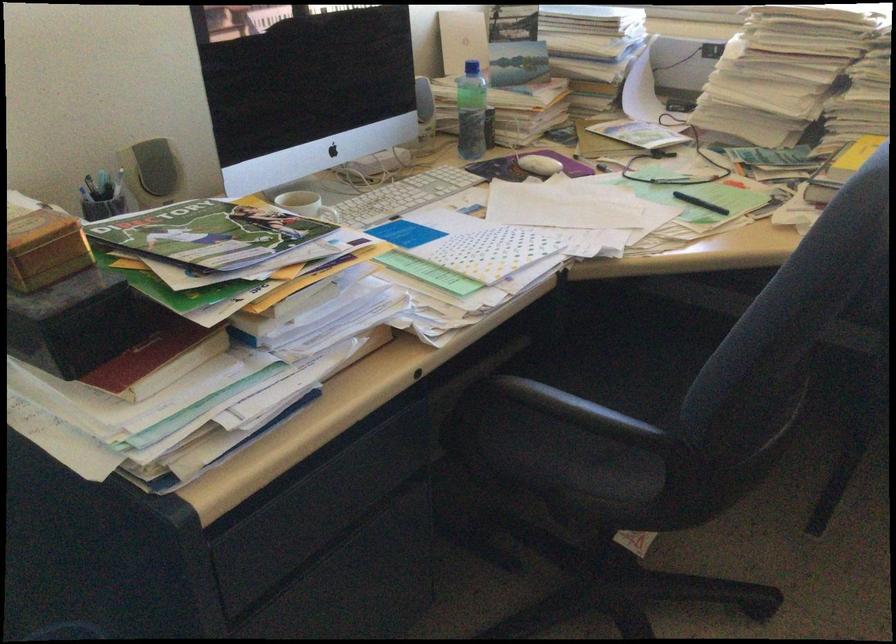
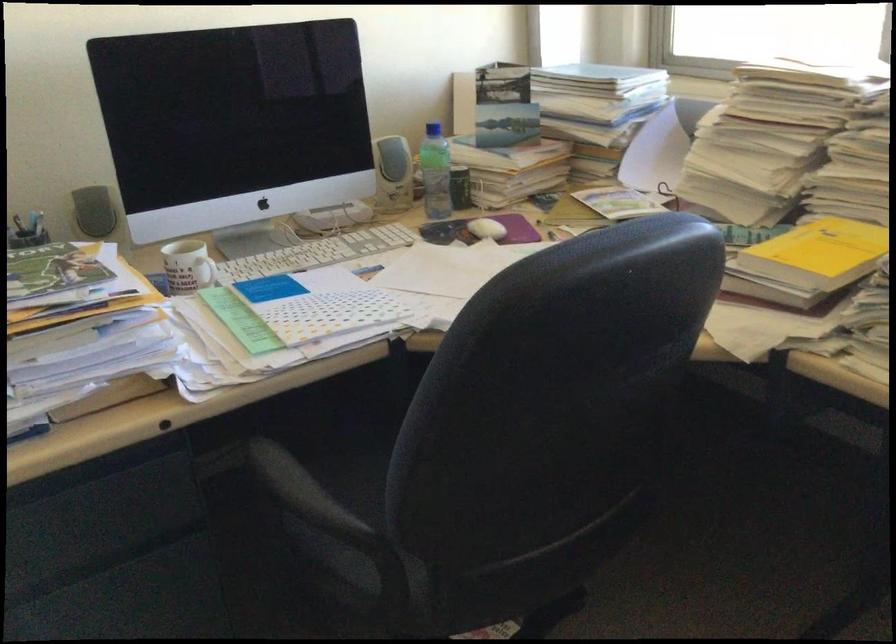
Question: I am providing you with two images of the same scene from different viewpoints. Which of the following objects are not visible in image2?

Choices:
 (A) black pen
 (B) chair sitting surface
 (C) blue bottle cap
 (D) wooden chair sitting surface

Answer: (A)